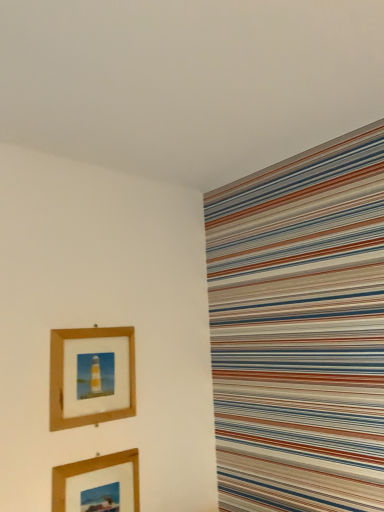
This screenshot has height=512, width=384. Identify the location of wooden picture frame at lower left, positioned as the 2th picture frame in top-to-bottom order. (98, 483).

What is the approximate width of wooden picture frame at lower left, positioned as the 2th picture frame in top-to-bottom order?

wooden picture frame at lower left, positioned as the 2th picture frame in top-to-bottom order, is 0.88 inches wide.

This screenshot has width=384, height=512. What do you see at coordinates (98, 483) in the screenshot?
I see `wooden picture frame at lower left, positioned as the 2th picture frame in top-to-bottom order` at bounding box center [98, 483].

Find the location of `wooden picture frame at upper left, the second picture frame in the bottom-to-top sequence`. wooden picture frame at upper left, the second picture frame in the bottom-to-top sequence is located at coordinates (91, 376).

Measure the distance between wooden picture frame at upper left, which is counted as the 1th picture frame, starting from the top, and camera.

wooden picture frame at upper left, which is counted as the 1th picture frame, starting from the top, and camera are 1.11 meters apart.

Describe the element at coordinates (91, 376) in the screenshot. I see `wooden picture frame at upper left, the second picture frame in the bottom-to-top sequence` at that location.

You are a GUI agent. You are given a task and a screenshot of the screen. Output one action in this format:
    pyautogui.click(x=<x>, y=<y>)
    Task: Click on the wooden picture frame at lower left, positioned as the 2th picture frame in top-to-bottom order
    The width and height of the screenshot is (384, 512).
    Given the screenshot: What is the action you would take?
    pyautogui.click(x=98, y=483)

In the image, is wooden picture frame at lower left, positioned as the 2th picture frame in top-to-bottom order, on the left side or the right side of wooden picture frame at upper left, the second picture frame in the bottom-to-top sequence?

Clearly, wooden picture frame at lower left, positioned as the 2th picture frame in top-to-bottom order, is on the right of wooden picture frame at upper left, the second picture frame in the bottom-to-top sequence, in the image.

Considering the relative positions of wooden picture frame at lower left, acting as the first picture frame starting from the bottom, and wooden picture frame at upper left, which is counted as the 1th picture frame, starting from the top, in the image provided, is wooden picture frame at lower left, acting as the first picture frame starting from the bottom, behind wooden picture frame at upper left, which is counted as the 1th picture frame, starting from the top,?

No, it is not.

Does point (78, 494) come closer to viewer compared to point (82, 424)?

Yes, it is in front of point (82, 424).

From the image's perspective, between wooden picture frame at lower left, acting as the first picture frame starting from the bottom, and wooden picture frame at upper left, which is counted as the 1th picture frame, starting from the top, who is located below?

wooden picture frame at lower left, acting as the first picture frame starting from the bottom, is shown below in the image.

From a real-world perspective, is wooden picture frame at lower left, positioned as the 2th picture frame in top-to-bottom order, positioned above or below wooden picture frame at upper left, which is counted as the 1th picture frame, starting from the top?

Clearly, from a real-world perspective, wooden picture frame at lower left, positioned as the 2th picture frame in top-to-bottom order, is below wooden picture frame at upper left, which is counted as the 1th picture frame, starting from the top.

Can you confirm if wooden picture frame at lower left, acting as the first picture frame starting from the bottom, is wider than wooden picture frame at upper left, the second picture frame in the bottom-to-top sequence?

In fact, wooden picture frame at lower left, acting as the first picture frame starting from the bottom, might be narrower than wooden picture frame at upper left, the second picture frame in the bottom-to-top sequence.

Consider the image. Which of these two, wooden picture frame at lower left, acting as the first picture frame starting from the bottom, or wooden picture frame at upper left, which is counted as the 1th picture frame, starting from the top, stands taller?

wooden picture frame at upper left, which is counted as the 1th picture frame, starting from the top, is taller.

Can you confirm if wooden picture frame at lower left, acting as the first picture frame starting from the bottom, is bigger than wooden picture frame at upper left, which is counted as the 1th picture frame, starting from the top?

No, wooden picture frame at lower left, acting as the first picture frame starting from the bottom, is not bigger than wooden picture frame at upper left, which is counted as the 1th picture frame, starting from the top.

Is wooden picture frame at lower left, acting as the first picture frame starting from the bottom, not inside wooden picture frame at upper left, which is counted as the 1th picture frame, starting from the top?

Indeed, wooden picture frame at lower left, acting as the first picture frame starting from the bottom, is completely outside wooden picture frame at upper left, which is counted as the 1th picture frame, starting from the top.

Is wooden picture frame at lower left, acting as the first picture frame starting from the bottom, not near wooden picture frame at upper left, which is counted as the 1th picture frame, starting from the top?

That's not correct — wooden picture frame at lower left, acting as the first picture frame starting from the bottom, is a little close to wooden picture frame at upper left, which is counted as the 1th picture frame, starting from the top.

Could you tell me if wooden picture frame at lower left, positioned as the 2th picture frame in top-to-bottom order, is facing wooden picture frame at upper left, the second picture frame in the bottom-to-top sequence?

No, wooden picture frame at lower left, positioned as the 2th picture frame in top-to-bottom order, is not turned towards wooden picture frame at upper left, the second picture frame in the bottom-to-top sequence.

Can you tell me how much wooden picture frame at lower left, positioned as the 2th picture frame in top-to-bottom order, and wooden picture frame at upper left, the second picture frame in the bottom-to-top sequence, differ in facing direction?

0.564 degrees separate the facing orientations of wooden picture frame at lower left, positioned as the 2th picture frame in top-to-bottom order, and wooden picture frame at upper left, the second picture frame in the bottom-to-top sequence.

The image size is (384, 512). I want to click on picture frame lying on the right of wooden picture frame at upper left, the second picture frame in the bottom-to-top sequence, so click(x=98, y=483).

Is wooden picture frame at upper left, the second picture frame in the bottom-to-top sequence, at the right side of wooden picture frame at lower left, acting as the first picture frame starting from the bottom?

No, wooden picture frame at upper left, the second picture frame in the bottom-to-top sequence, is not to the right of wooden picture frame at lower left, acting as the first picture frame starting from the bottom.

Which object is more forward, wooden picture frame at upper left, the second picture frame in the bottom-to-top sequence, or wooden picture frame at lower left, acting as the first picture frame starting from the bottom?

wooden picture frame at lower left, acting as the first picture frame starting from the bottom, is in front.

Does point (77, 332) come farther from viewer compared to point (132, 492)?

No.

From the image's perspective, is wooden picture frame at upper left, which is counted as the 1th picture frame, starting from the top, below wooden picture frame at lower left, positioned as the 2th picture frame in top-to-bottom order?

No.

From a real-world perspective, is wooden picture frame at upper left, which is counted as the 1th picture frame, starting from the top, physically located above or below wooden picture frame at lower left, positioned as the 2th picture frame in top-to-bottom order?

Clearly, from a real-world perspective, wooden picture frame at upper left, which is counted as the 1th picture frame, starting from the top, is above wooden picture frame at lower left, positioned as the 2th picture frame in top-to-bottom order.

Looking at their sizes, would you say wooden picture frame at upper left, which is counted as the 1th picture frame, starting from the top, is wider or thinner than wooden picture frame at lower left, acting as the first picture frame starting from the bottom?

wooden picture frame at upper left, which is counted as the 1th picture frame, starting from the top, is wider than wooden picture frame at lower left, acting as the first picture frame starting from the bottom.

Between wooden picture frame at upper left, the second picture frame in the bottom-to-top sequence, and wooden picture frame at lower left, acting as the first picture frame starting from the bottom, which one has less height?

wooden picture frame at lower left, acting as the first picture frame starting from the bottom.

In terms of size, does wooden picture frame at upper left, the second picture frame in the bottom-to-top sequence, appear bigger or smaller than wooden picture frame at lower left, acting as the first picture frame starting from the bottom?

Considering their sizes, wooden picture frame at upper left, the second picture frame in the bottom-to-top sequence, takes up more space than wooden picture frame at lower left, acting as the first picture frame starting from the bottom.

Is wooden picture frame at upper left, which is counted as the 1th picture frame, starting from the top, spatially inside wooden picture frame at lower left, positioned as the 2th picture frame in top-to-bottom order, or outside of it?

The correct answer is: outside.

Would you consider wooden picture frame at upper left, which is counted as the 1th picture frame, starting from the top, to be distant from wooden picture frame at lower left, acting as the first picture frame starting from the bottom?

No, there isn't a large distance between wooden picture frame at upper left, which is counted as the 1th picture frame, starting from the top, and wooden picture frame at lower left, acting as the first picture frame starting from the bottom.

Is wooden picture frame at lower left, acting as the first picture frame starting from the bottom, at the back of wooden picture frame at upper left, the second picture frame in the bottom-to-top sequence?

No, wooden picture frame at lower left, acting as the first picture frame starting from the bottom, is not at the back of wooden picture frame at upper left, the second picture frame in the bottom-to-top sequence.

What's the angular difference between wooden picture frame at upper left, the second picture frame in the bottom-to-top sequence, and wooden picture frame at lower left, acting as the first picture frame starting from the bottom,'s facing directions?

They differ by 0.564 degrees in their facing directions.

Find the location of a particular element. This screenshot has height=512, width=384. picture frame that appears below the wooden picture frame at upper left, the second picture frame in the bottom-to-top sequence (from the image's perspective) is located at coordinates (98, 483).

Identify the location of picture frame above the wooden picture frame at lower left, positioned as the 2th picture frame in top-to-bottom order (from a real-world perspective). (91, 376).

Where is `picture frame on the right of wooden picture frame at upper left, which is counted as the 1th picture frame, starting from the top`? The width and height of the screenshot is (384, 512). picture frame on the right of wooden picture frame at upper left, which is counted as the 1th picture frame, starting from the top is located at coordinates (98, 483).